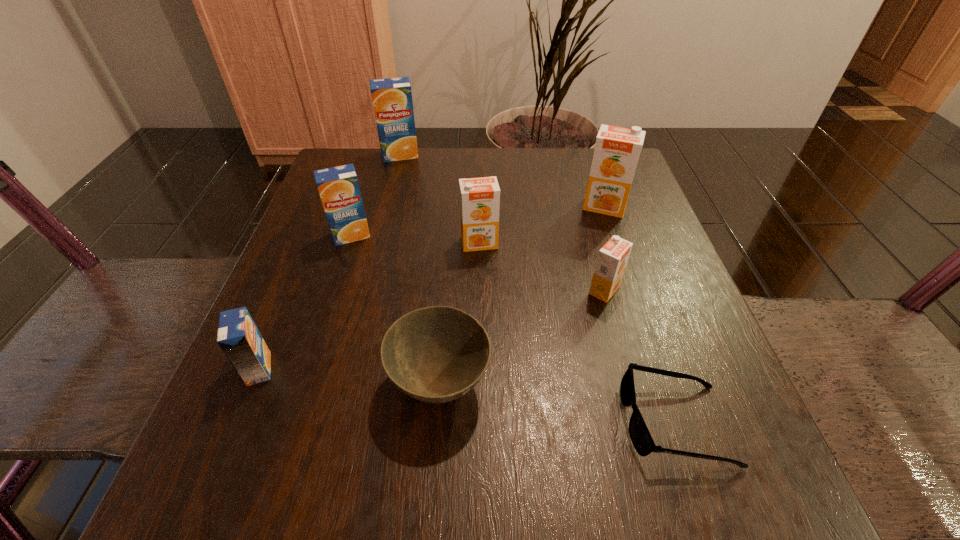
Find the location of a particular element. vacant space positioned 0.210m on the front-facing side of the shortest object is located at coordinates (471, 422).

Locate an element on the screen. free space located 0.260m on the front-facing side of the shortest object is located at coordinates (435, 422).

Where is `free region located on the front-facing side of the shortest object`? free region located on the front-facing side of the shortest object is located at coordinates (450, 422).

At what (x,y) coordinates should I click in order to perform the action: click on object that is positioned at the near edge. Please return your answer as a coordinate pair (x, y). Looking at the image, I should click on (640, 436).

I want to click on sunglasses that is at the right edge, so point(640,436).

Where is `object that is at the far left corner`? This screenshot has height=540, width=960. object that is at the far left corner is located at coordinates (392, 98).

Image resolution: width=960 pixels, height=540 pixels. What are the coordinates of `object that is at the far right corner` in the screenshot? It's located at (617, 149).

The height and width of the screenshot is (540, 960). Identify the location of object at the near right corner. (640, 436).

Image resolution: width=960 pixels, height=540 pixels. I want to click on vacant area at the far edge, so click(409, 163).

The width and height of the screenshot is (960, 540). Identify the location of vacant space at the near edge of the desktop. [318, 497].